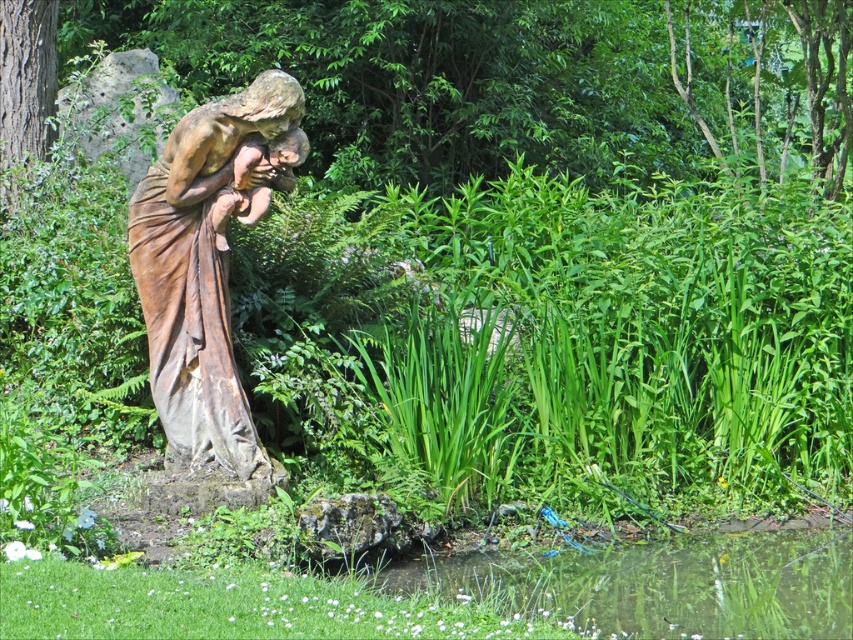
Between point (260, 179) and point (845, 608), which one is positioned behind?

The point (260, 179) is behind.

This screenshot has height=640, width=853. What do you see at coordinates (207, 264) in the screenshot?
I see `brown stone statue at center` at bounding box center [207, 264].

This screenshot has height=640, width=853. Identify the location of brown stone statue at center. (207, 264).

Where is `brown stone statue at center`? This screenshot has width=853, height=640. brown stone statue at center is located at coordinates click(x=207, y=264).